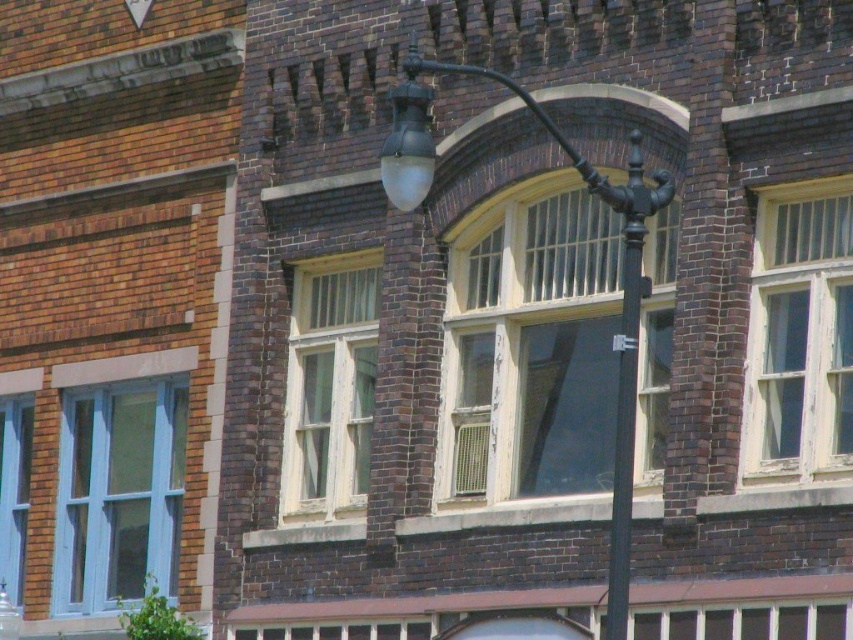
You are an architect inspecting the building facade. You need to compare the height of the clear glass window at center and the white wooden window at right. Which one is taller?

The white wooden window at right is taller than the clear glass window at center.

What are the coordinates of the clear glass window at center?

The clear glass window at center is located at coordinates point (x=531, y=346).